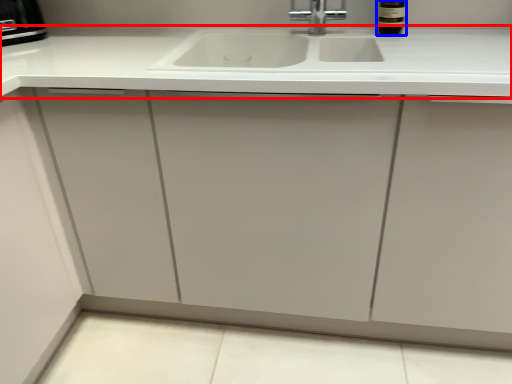
Question: Which object appears closest to the camera in this image, countertop (highlighted by a red box) or wine bottle (highlighted by a blue box)?

Choices:
 (A) countertop
 (B) wine bottle

Answer: (A)